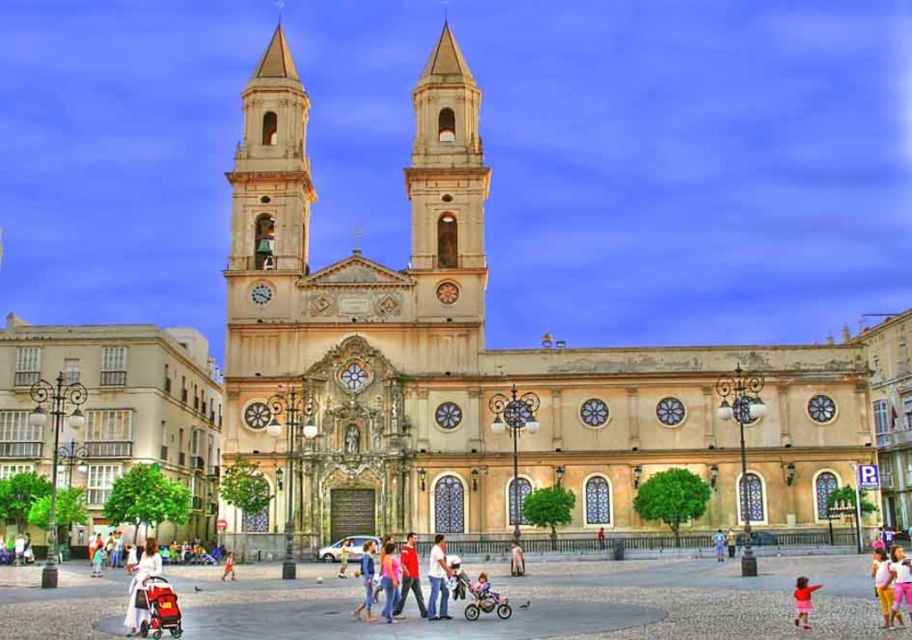
Which of these two, light blue jeans at center or red cotton shirt at center, stands shorter?

red cotton shirt at center

Does light blue jeans at center have a greater height compared to red cotton shirt at center?

Indeed, light blue jeans at center has a greater height compared to red cotton shirt at center.

In order to click on light blue jeans at center in this screenshot , I will do `click(437, 580)`.

Which is more to the left, beige stone church at center or white cotton shirt at lower center?

white cotton shirt at lower center is more to the left.

In the scene shown: Who is more forward, (267, 248) or (225, 579)?

Point (225, 579)

Locate an element on the screen. This screenshot has width=912, height=640. beige stone church at center is located at coordinates (480, 364).

Is white cotton dress at lower left wider than matte pink dress at center?

Indeed, white cotton dress at lower left has a greater width compared to matte pink dress at center.

Is point (142, 564) farther from camera compared to point (382, 570)?

That is True.

Measure the distance between white cotton dress at lower left and camera.

white cotton dress at lower left and camera are 61.93 meters apart from each other.

This screenshot has width=912, height=640. In order to click on white cotton dress at lower left in this screenshot , I will do `click(141, 586)`.